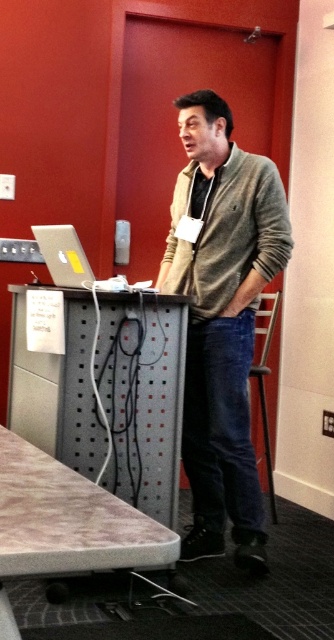
Who is positioned more to the left, metallic gray table at center or wooden table at lower left?

From the viewer's perspective, metallic gray table at center appears more on the left side.

Which is in front, point (56, 440) or point (112, 532)?

Point (112, 532) is more forward.

Between point (120, 300) and point (11, 508), which one is positioned in front?

Point (11, 508) is more forward.

This screenshot has height=640, width=334. Identify the location of metallic gray table at center. (142, 397).

Between matte gray sweater at center and silver metallic laptop at left, which one has more height?

matte gray sweater at center is taller.

Who is shorter, matte gray sweater at center or silver metallic laptop at left?

Standing shorter between the two is silver metallic laptop at left.

You are a GUI agent. You are given a task and a screenshot of the screen. Output one action in this format:
    pyautogui.click(x=<x>, y=<y>)
    Task: Click on the matte gray sweater at center
    This screenshot has height=640, width=334.
    Given the screenshot: What is the action you would take?
    tap(222, 317)

The height and width of the screenshot is (640, 334). Find the location of `matte gray sweater at center`. matte gray sweater at center is located at coordinates (222, 317).

Who is positioned more to the left, metallic gray table at center or silver metallic laptop at left?

silver metallic laptop at left

Does metallic gray table at center have a greater width compared to silver metallic laptop at left?

→ Correct, the width of metallic gray table at center exceeds that of silver metallic laptop at left.

Between point (45, 289) and point (59, 227), which one is positioned behind?

The point (45, 289) is more distant.

Identify the location of metallic gray table at center. The image size is (334, 640). (142, 397).